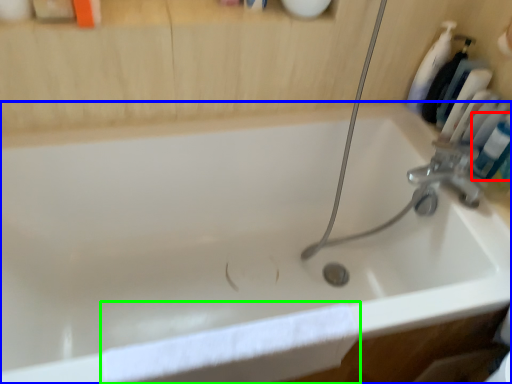
Question: Which object is positioned farthest from mouthwash (highlighted by a red box)? Select from bathtub (highlighted by a blue box) and bath towel (highlighted by a green box).

Choices:
 (A) bathtub
 (B) bath towel

Answer: (B)